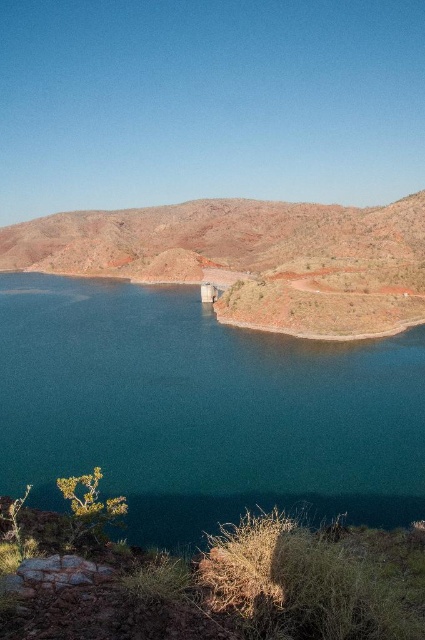
You are standing at the point labeled point (201, 410) in the image. What object are you currently standing on?

The point labeled point (201, 410) corresponds to the teal glossy water at center, so you are standing on the teal glossy water at center.

You are planning to build a small boat dock on the lakeside. The dock needs to be as wide as the teal glossy water at center. Will the dock fit within the width of the rustic brown hillside at center?

The teal glossy water at center is narrower than the rustic brown hillside at center, so the dock designed to match the water width will fit within the hillside width.

You are planning to build a small boat dock on the lakeside. Given the sizes of the teal glossy water at center and rustic brown hillside at center, which area would be more suitable for the dock and why?

The teal glossy water at center is smaller in size compared to the rustic brown hillside at center. Therefore, the rustic brown hillside at center is more suitable for building the dock because it has a larger area to accommodate the structure.